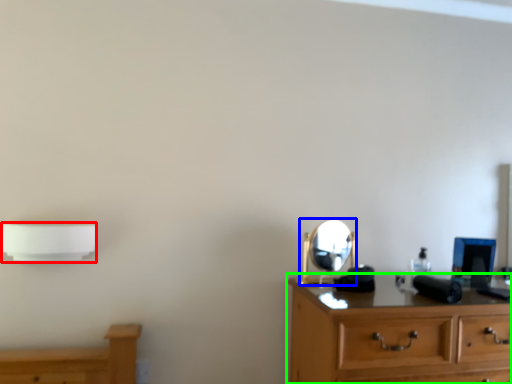
Question: Considering the real-world distances, which object is farthest from lamp (highlighted by a red box)? mirror (highlighted by a blue box) or chest of drawers (highlighted by a green box)?

Choices:
 (A) mirror
 (B) chest of drawers

Answer: (B)